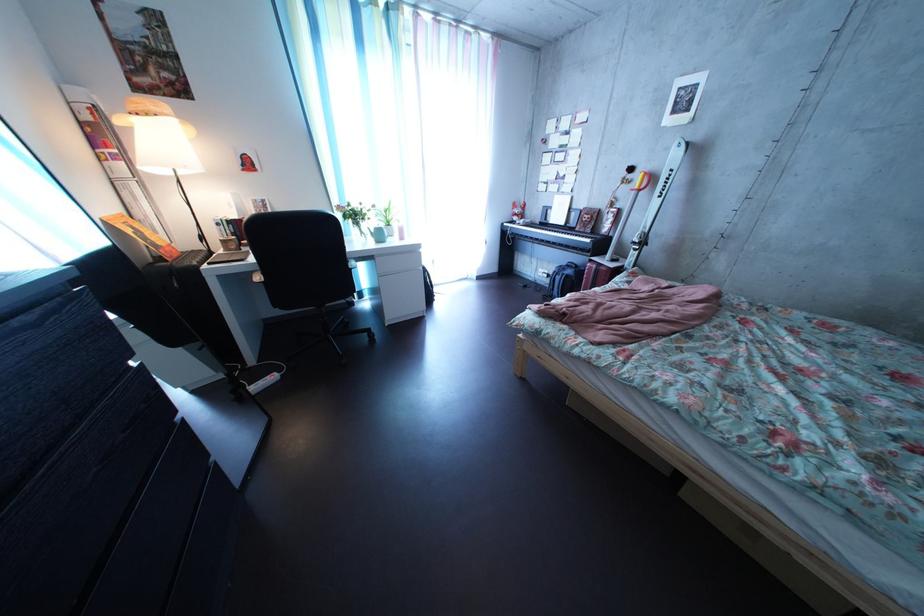
Locate an element on the screen. The height and width of the screenshot is (616, 924). Volkl ski is located at coordinates (657, 201).